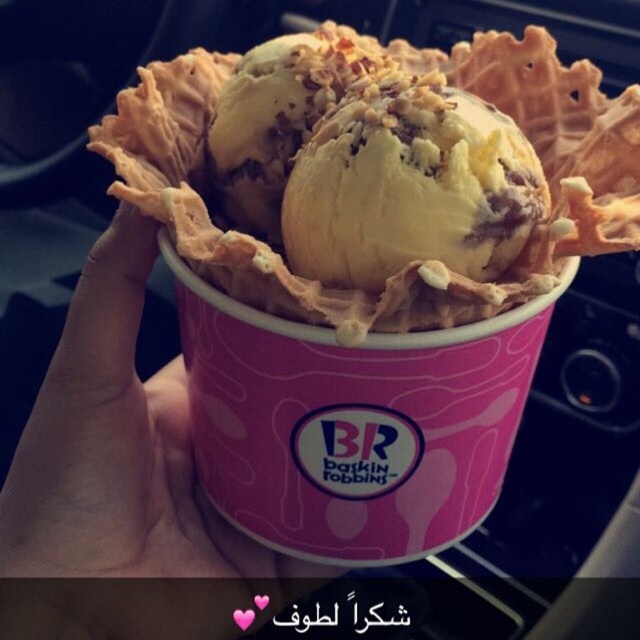
You are sitting in the passenger seat of a car and see the pink Baskin Robbins ice cream cup in your hand. You notice two points marked on the cup at coordinates point [561,148] and point [221,570]. Which point is closer to you?

Point [561,148] is closer to the camera than point [221,570], so the point [561,148] is closer to you.

You are a customer at Baskin Robbins holding the pink paper cup at center with the yellow creamy ice cream at center inside. You want to place your ice cream on the car dashboard so that the Baskin Robbins logo faces forward. Which side of the cup should you turn to ensure the logo is visible?

The yellow creamy ice cream at center is to the right of the pink paper cup at center, so turning the cup to the left will position the logo facing forward.